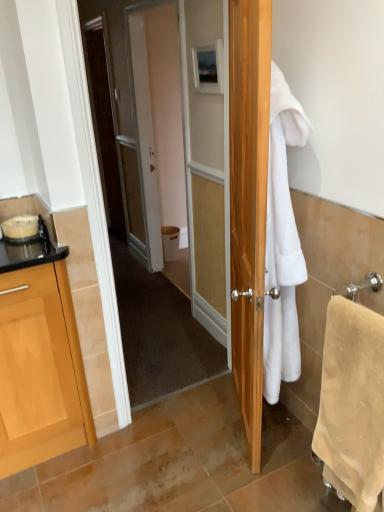
Question: Is white plastic trash bin at center wider than beige soft towel at right, which is the 2th towel/napkin in left-to-right order?

Choices:
 (A) yes
 (B) no

Answer: (A)

Question: Considering the relative sizes of white plastic trash bin at center and beige soft towel at right, acting as the 1th towel/napkin starting from the right, in the image provided, is white plastic trash bin at center taller than beige soft towel at right, acting as the 1th towel/napkin starting from the right,?

Choices:
 (A) yes
 (B) no

Answer: (B)

Question: Does white plastic trash bin at center have a lesser width compared to beige soft towel at right, which is the 2th towel/napkin in left-to-right order?

Choices:
 (A) yes
 (B) no

Answer: (B)

Question: Is white plastic trash bin at center bigger than beige soft towel at right, which is the 2th towel/napkin in left-to-right order?

Choices:
 (A) no
 (B) yes

Answer: (A)

Question: From a real-world perspective, is white plastic trash bin at center over beige soft towel at right, acting as the 1th towel/napkin starting from the right?

Choices:
 (A) yes
 (B) no

Answer: (B)

Question: Is white plastic trash bin at center far away from beige soft towel at right, acting as the 1th towel/napkin starting from the right?

Choices:
 (A) yes
 (B) no

Answer: (A)

Question: Is matte wooden picture frame at upper center to the left of beige soft towel at right, acting as the 1th towel/napkin starting from the right, from the viewer's perspective?

Choices:
 (A) yes
 (B) no

Answer: (A)

Question: From the image's perspective, is matte wooden picture frame at upper center located beneath beige soft towel at right, acting as the 1th towel/napkin starting from the right?

Choices:
 (A) yes
 (B) no

Answer: (B)

Question: From a real-world perspective, is matte wooden picture frame at upper center positioned over beige soft towel at right, acting as the 1th towel/napkin starting from the right, based on gravity?

Choices:
 (A) no
 (B) yes

Answer: (B)

Question: From a real-world perspective, is matte wooden picture frame at upper center physically below beige soft towel at right, which is the 2th towel/napkin in left-to-right order?

Choices:
 (A) yes
 (B) no

Answer: (B)

Question: Is matte wooden picture frame at upper center oriented away from beige soft towel at right, which is the 2th towel/napkin in left-to-right order?

Choices:
 (A) no
 (B) yes

Answer: (A)

Question: Is matte wooden picture frame at upper center taller than beige soft towel at right, which is the 2th towel/napkin in left-to-right order?

Choices:
 (A) no
 (B) yes

Answer: (A)

Question: From the image's perspective, would you say matte wooden picture frame at upper center is positioned over white fluffy towel at right, positioned as the 2th towel/napkin in right-to-left order?

Choices:
 (A) no
 (B) yes

Answer: (B)